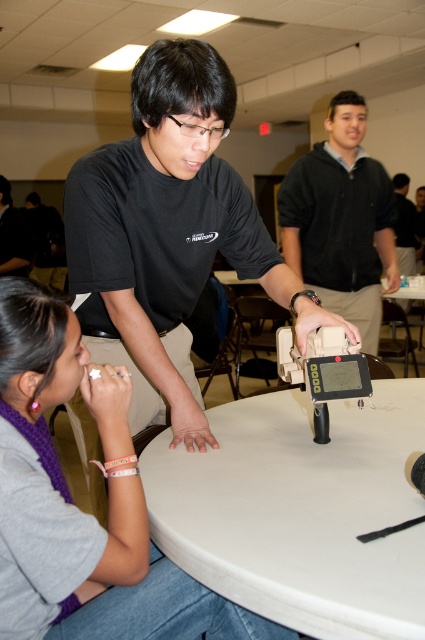
You are organizing a clothing display and need to arrange the matte black shirt at center and the black matte shirt at upper center on a shelf. Which shirt should be placed on the left side of the shelf to ensure proper visibility?

The matte black shirt at center should be placed on the left side of the shelf because it is wider than the black matte shirt at upper center, making it more visible when displayed first.

You are standing in the classroom and need to determine which of the two points, point (x=170, y=214) or point (x=404, y=232), is nearer to you. Can you identify the closer one based on their positions?

Point (x=170, y=214) is closer to the viewer than point (x=404, y=232), so the closer one is point (x=170, y=214).

You are standing in the classroom and want to know which person is shorter between the matte black shirt at center and the dark gray hoodie at center. Can you tell me?

The matte black shirt at center is not as tall as dark gray hoodie at center, so the matte black shirt at center is shorter.